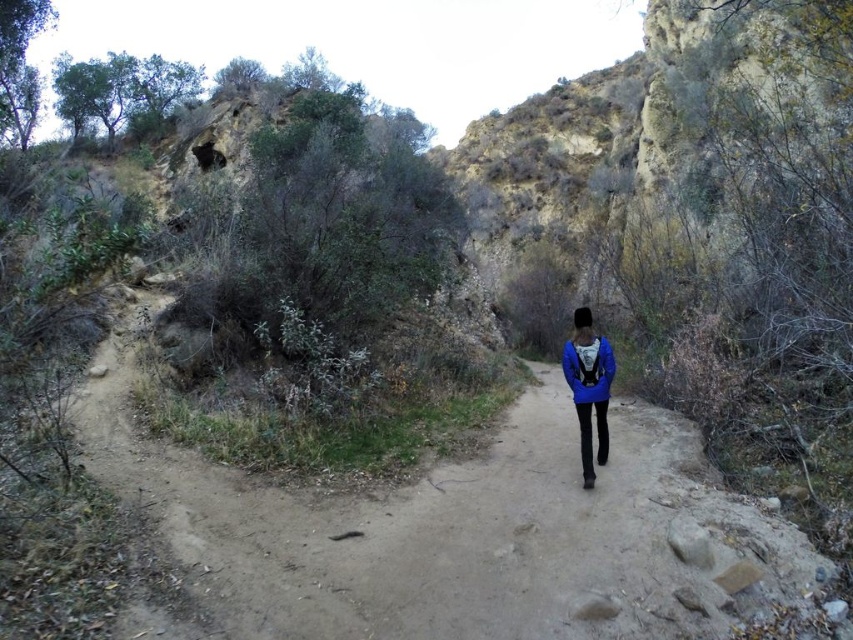
You are a hiker carrying a backpack and you see the dirt path at center and the blue matte jacket at center. Which object is higher in elevation?

The dirt path at center is higher in elevation than the blue matte jacket at center because the dirt path at center has a greater height compared to blue matte jacket at center.

You are a hiker carrying a heavy backpack and see the dirt path at center and the blue matte jacket at center. Which object is positioned to the left of the other?

The dirt path at center is to the left of the blue matte jacket at center.